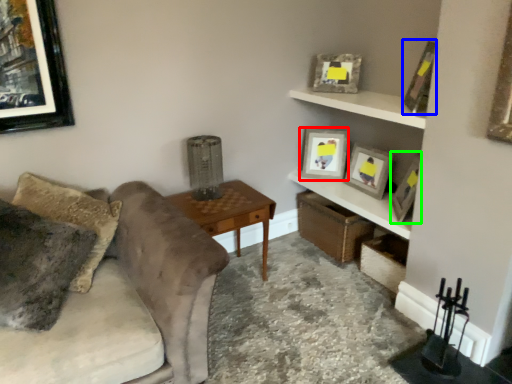
Question: Which object is positioned closest to picture frame (highlighted by a red box)? Select from picture frame (highlighted by a blue box) and picture frame (highlighted by a green box).

Choices:
 (A) picture frame
 (B) picture frame

Answer: (B)